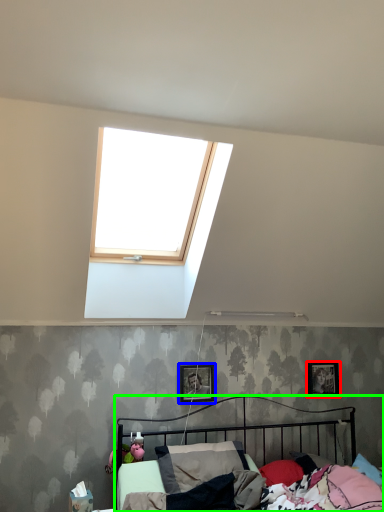
Question: Estimate the real-world distances between objects in this image. Which object is farther from picture frame (highlighted by a red box), picture frame (highlighted by a blue box) or bed (highlighted by a green box)?

Choices:
 (A) picture frame
 (B) bed

Answer: (A)